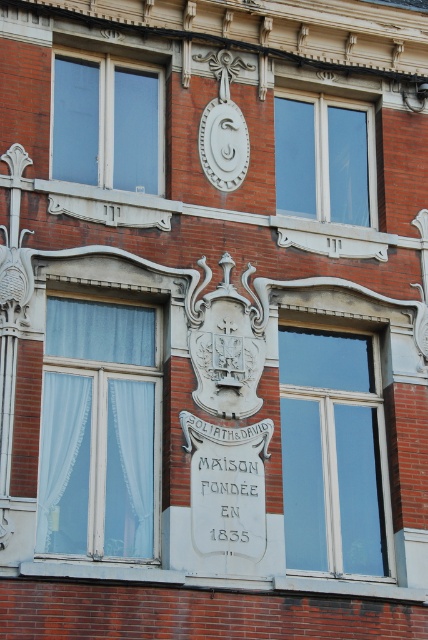
You are standing in front of the building and notice the clear glass window at upper center and the white matte clock at upper center. Which object is positioned higher on the building?

The white matte clock at upper center is positioned higher because the clear glass window at upper center is located below it.

You are a visitor standing in front of the building and want to read the inscription on the white stone plaque at center. Since the plaque is below the white matte clock at upper center, will you need to look up or down to see it?

The white stone plaque at center is located below the white matte clock at upper center, so you will need to look down to see it.